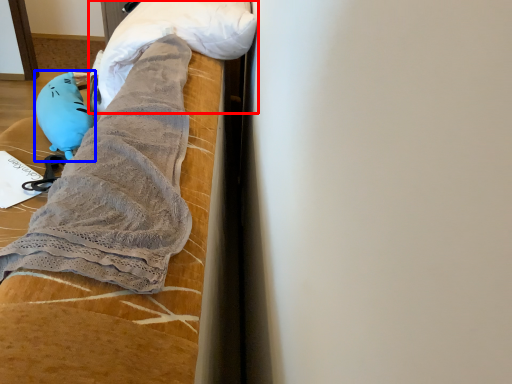
Question: Which object is closer to the camera taking this photo, wrap (highlighted by a red box) or toy (highlighted by a blue box)?

Choices:
 (A) wrap
 (B) toy

Answer: (A)